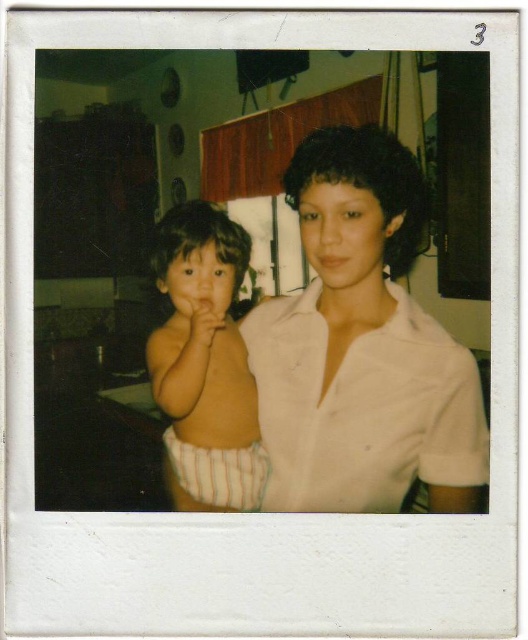
Does white smooth shirt at center have a lesser width compared to striped diaper at left?

Incorrect, white smooth shirt at center's width is not less than striped diaper at left's.

Can you confirm if white smooth shirt at center is bigger than striped diaper at left?

Indeed, white smooth shirt at center has a larger size compared to striped diaper at left.

Is point (261, 368) positioned behind point (253, 492)?

No, (261, 368) is closer to viewer.

In order to click on white smooth shirt at center in this screenshot , I will do `click(362, 346)`.